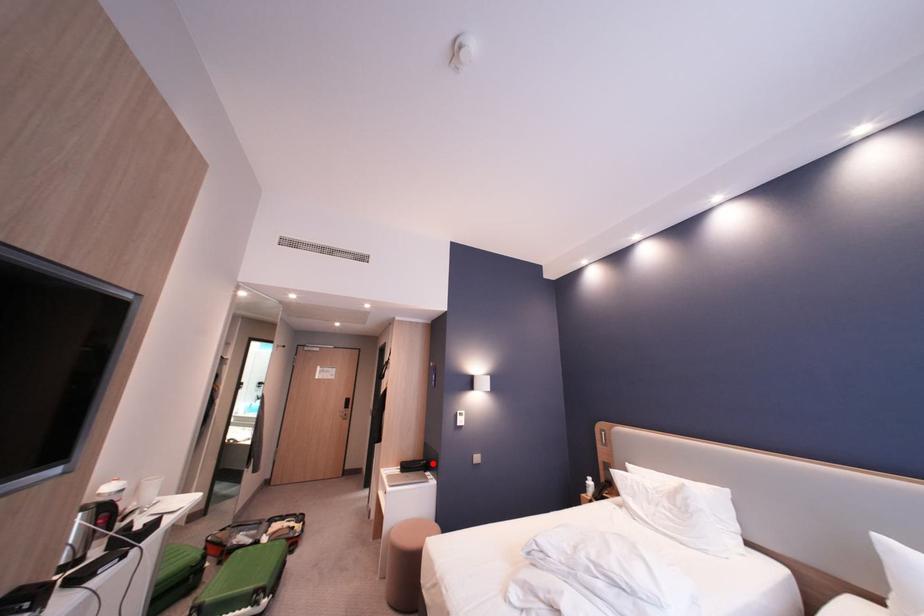
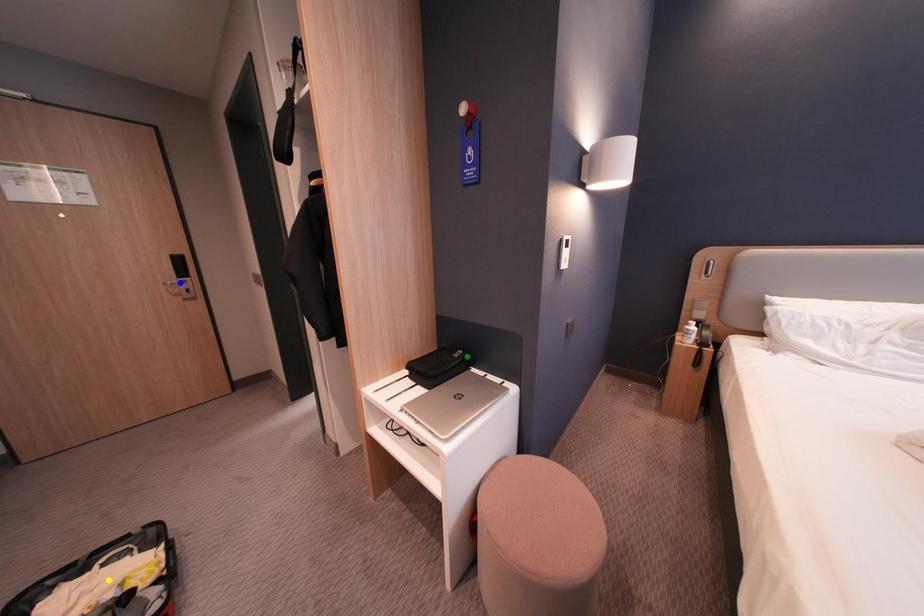
Question: I am providing you with two images of the same scene from different viewpoints. A red point is marked on the first image. You are given multiple points on the second image. Which point in image 2 is actually the same real-world point as the red point in image 1?

Choices:
 (A) yellow point
 (B) blue point
 (C) green point

Answer: (C)